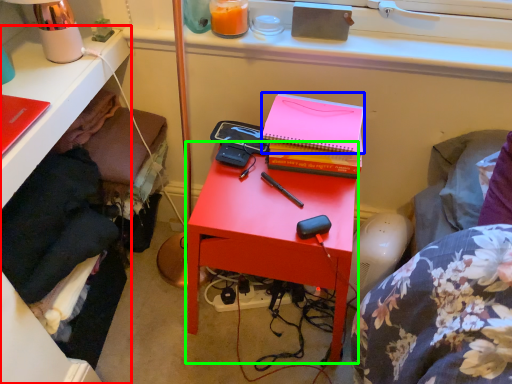
Question: Which object is positioned closest to desk (highlighted by a red box)? Select from paperback book (highlighted by a blue box) and nightstand (highlighted by a green box).

Choices:
 (A) paperback book
 (B) nightstand

Answer: (B)